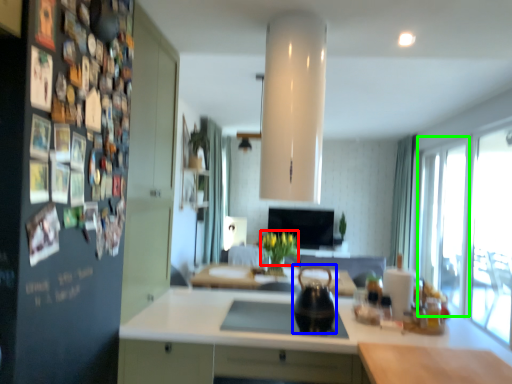
Question: Estimate the real-world distances between objects in this image. Which object is closer to flower (highlighted by a red box), tea pot (highlighted by a blue box) or glass door (highlighted by a green box)?

Choices:
 (A) tea pot
 (B) glass door

Answer: (A)